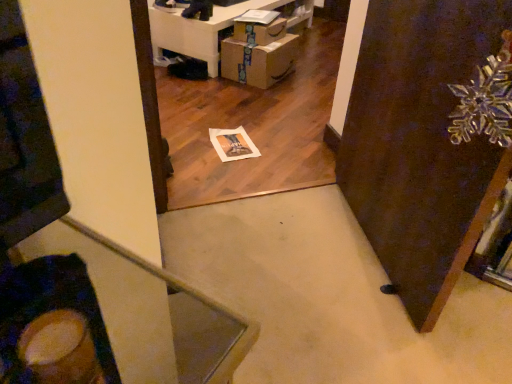
I want to click on free space underneath transparent glass snowflake at upper right (from a real-world perspective), so click(x=366, y=244).